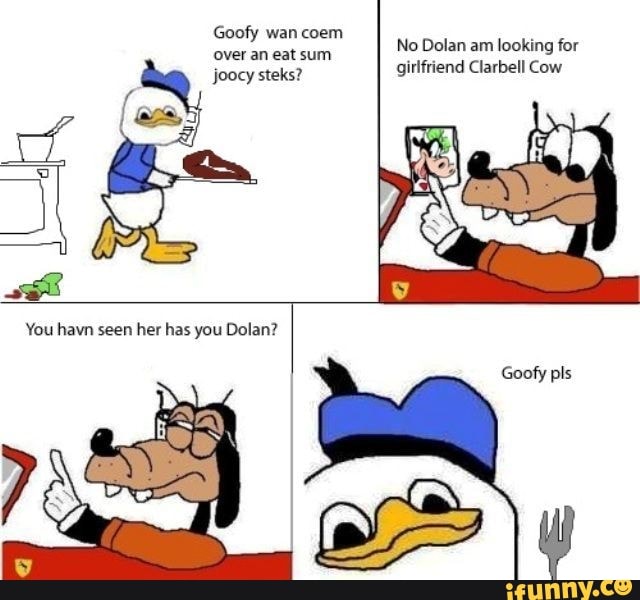
Locate an element on the screen. phone is located at coordinates (192, 126), (531, 139).